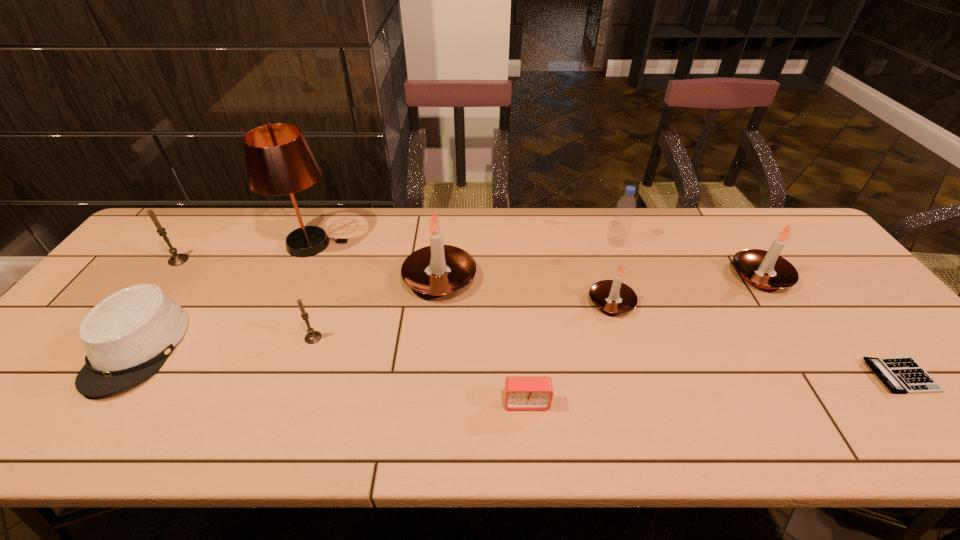
You are a GUI agent. You are given a task and a screenshot of the screen. Output one action in this format:
    pyautogui.click(x=<x>, y=<y>)
    Task: Click on the vacant area that lies between the blue bottle and the smallest white candle
    
    Given the screenshot: What is the action you would take?
    pyautogui.click(x=614, y=272)

The width and height of the screenshot is (960, 540). I want to click on empty space between the eighth tallest object and the nearer gray candle, so click(x=225, y=343).

Find the location of a particular element. blank region between the fourth candle from left to right and the third candle from right to left is located at coordinates (525, 291).

In order to click on free space that is in between the tallest candle and the second biggest white candle in this screenshot , I will do `click(600, 277)`.

This screenshot has width=960, height=540. What are the coordinates of `free space between the tallest object and the bigger gray candle` in the screenshot? It's located at (245, 252).

Image resolution: width=960 pixels, height=540 pixels. Find the location of `vacant space that is in between the rightmost candle and the nearest candle`. vacant space that is in between the rightmost candle and the nearest candle is located at coordinates (537, 307).

The image size is (960, 540). I want to click on unoccupied position between the lampshade and the nearer gray candle, so click(312, 291).

Where is `free area in between the lampshade and the bottle`? free area in between the lampshade and the bottle is located at coordinates (465, 244).

You are a GUI agent. You are given a task and a screenshot of the screen. Output one action in this format:
    pyautogui.click(x=<x>, y=<y>)
    Task: Click on the free space between the fourth candle from left to right and the alarm clock
    The image size is (960, 540).
    Given the screenshot: What is the action you would take?
    pyautogui.click(x=569, y=352)

Identify which object is located as the fourth nearest to the lampshade. Please provide its 2D coordinates. Your answer should be formatted as a tuple, i.e. [(x, y)], where the tuple contains the x and y coordinates of a point satisfying the conditions above.

[(312, 336)]